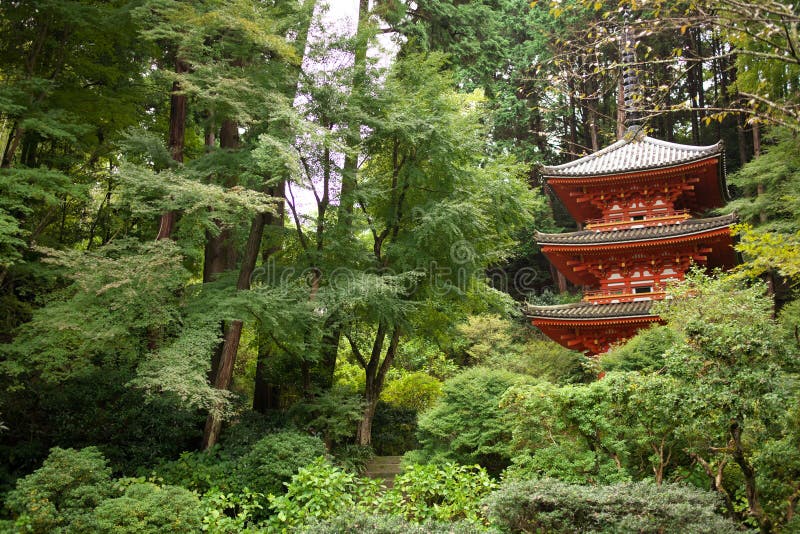
The height and width of the screenshot is (534, 800). Identify the location of stairs. (382, 468).